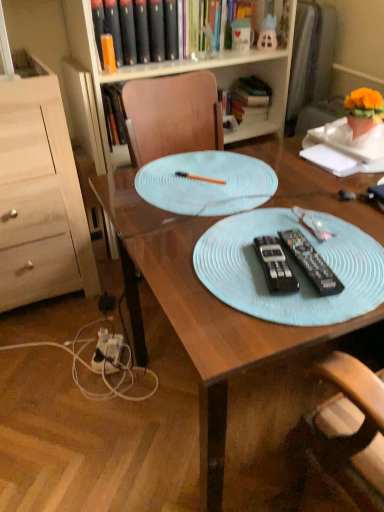
Where is `vacant region to the left of orange fabric flower pot at upper right`? The image size is (384, 512). vacant region to the left of orange fabric flower pot at upper right is located at coordinates (324, 138).